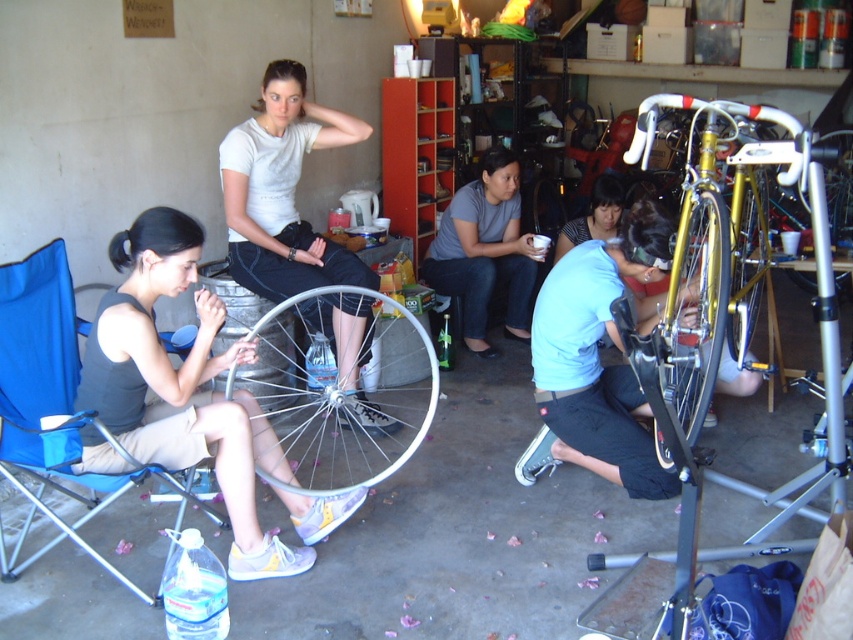
You are a mechanic working in the garage. You need to access the gold metallic bicycle wheel at right. Is the gold metallic bicycle wheel at center right blocking your path to it?

The gold metallic bicycle wheel at center right is positioned under the gold metallic bicycle wheel at right, so it is blocking the path to the gold metallic bicycle wheel at right. You will need to move the gold metallic bicycle wheel at center right first.

You are standing in the workshop and need to reach an object on a high shelf. You have the matte gray shirt at center and the gold metallic bicycle wheel at center nearby. Which object can you use as a makeshift step stool?

The matte gray shirt at center is taller than the gold metallic bicycle wheel at center, so it would be more suitable to use the matte gray shirt at center as a makeshift step stool since it has a greater height.

You are a photographer setting up a shoot in this workshop. You need to position a light source so that it illuminates the matte gray tank top at lower left and the gold metallic bicycle wheel at center without casting shadows on the wall behind them. Considering their heights, which object should be placed closer to the light source to ensure both are evenly lit?

The gold metallic bicycle wheel at center should be placed closer to the light source because the matte gray tank top at lower left is taller. By positioning the shorter gold metallic bicycle wheel at center nearer to the light, both objects will receive similar illumination levels, preventing shadows from overlapping on the wall.